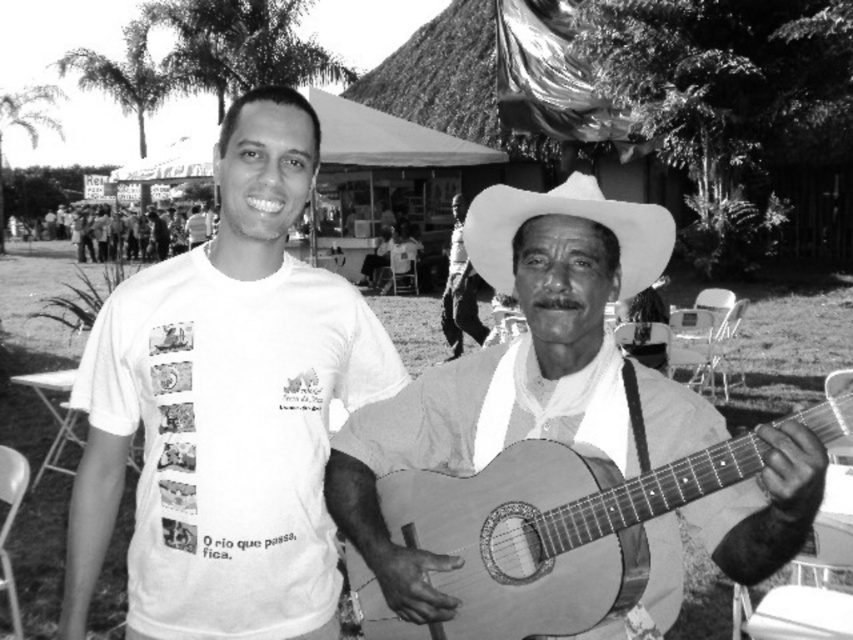
Question: Which object is closer to the camera taking this photo?

Choices:
 (A) wooden acoustic guitar at center
 (B) matte white shirt at center
 (C) white felt sombrero at center
 (D) white cotton t-shirt at center

Answer: (A)

Question: Is wooden acoustic guitar at center thinner than matte white shirt at center?

Choices:
 (A) yes
 (B) no

Answer: (A)

Question: Among these objects, which one is farthest from the camera?

Choices:
 (A) matte white shirt at center
 (B) white cotton t-shirt at center

Answer: (A)

Question: Can you confirm if white cotton t-shirt at center is wider than wooden acoustic guitar at center?

Choices:
 (A) yes
 (B) no

Answer: (B)

Question: Is white cotton t-shirt at center above matte white shirt at center?

Choices:
 (A) yes
 (B) no

Answer: (B)

Question: Which object appears closest to the camera in this image?

Choices:
 (A) white cotton t-shirt at center
 (B) matte white shirt at center
 (C) white felt sombrero at center

Answer: (C)